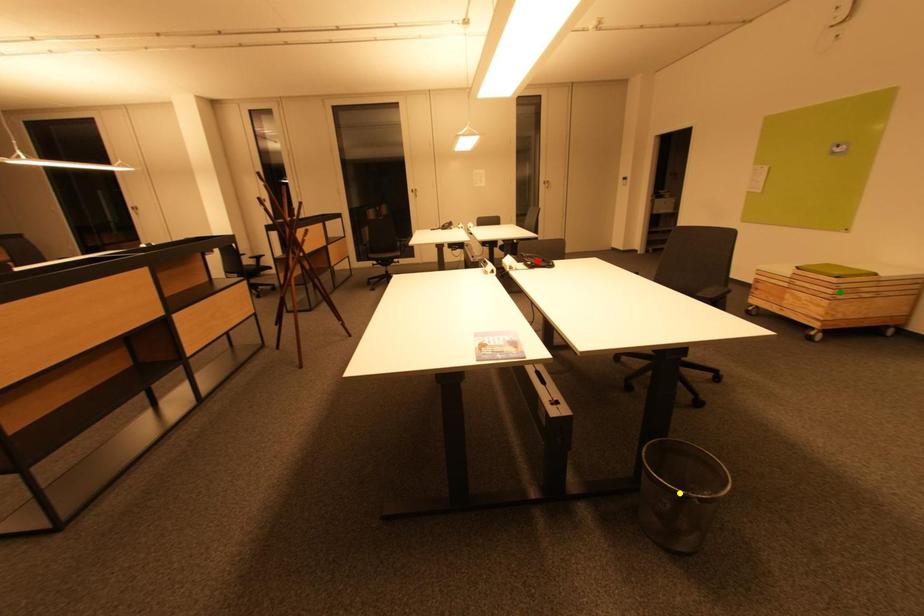
Order these from nearest to farthest:
1. red point
2. green point
3. yellow point

yellow point → red point → green point